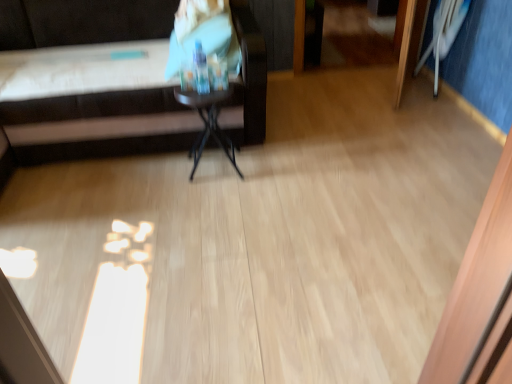
The image size is (512, 384). I want to click on vacant space that's between black glossy side table at center and white plastic swivel chair at upper right, so click(x=333, y=129).